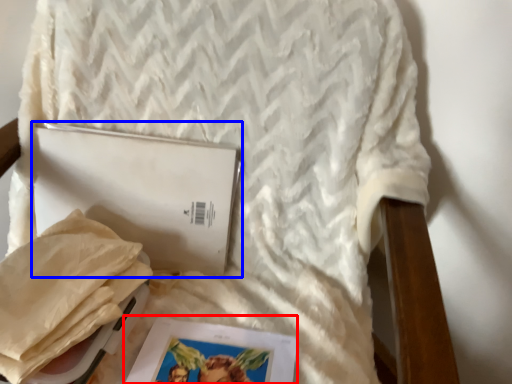
Question: Which object appears closest to the camera in this image, magazine (highlighted by a red box) or journal (highlighted by a blue box)?

Choices:
 (A) magazine
 (B) journal

Answer: (A)